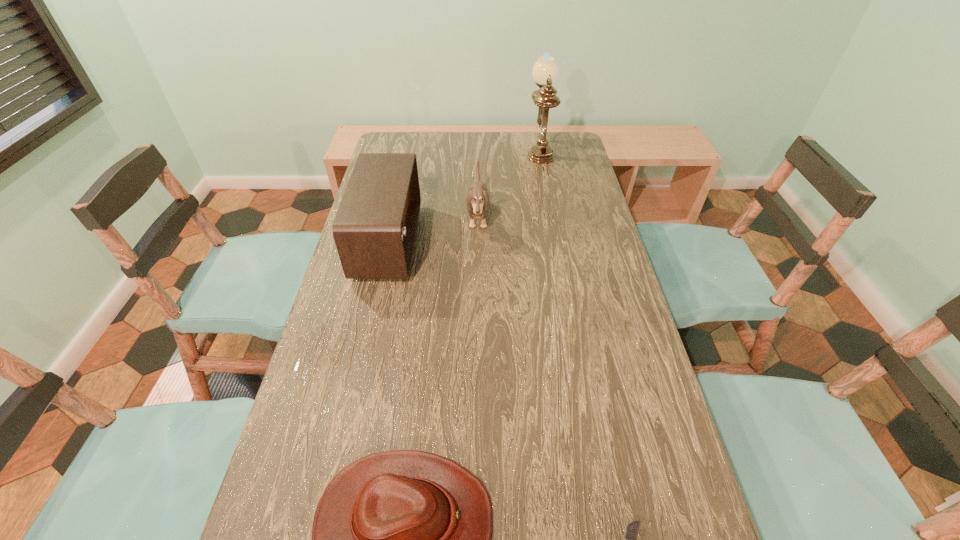
The image size is (960, 540). In order to click on oil lamp in this screenshot , I will do `click(545, 70)`.

Where is `the farthest object`? the farthest object is located at coordinates (545, 70).

The height and width of the screenshot is (540, 960). I want to click on radio receiver, so click(x=374, y=230).

Image resolution: width=960 pixels, height=540 pixels. In order to click on the third tallest object in this screenshot , I will do `click(478, 208)`.

The width and height of the screenshot is (960, 540). In order to click on free spot located on the left of the oil lamp in this screenshot , I will do `click(501, 149)`.

This screenshot has height=540, width=960. What are the coordinates of `blank space located on the front-facing side of the radio receiver` in the screenshot? It's located at (435, 242).

At what (x,y) coordinates should I click in order to perform the action: click on free space located 0.080m at the face of the third shortest object. Please return your answer as a coordinate pair (x, y). Image resolution: width=960 pixels, height=540 pixels. Looking at the image, I should click on (513, 217).

At what (x,y) coordinates should I click in order to perform the action: click on object that is at the far edge. Please return your answer as a coordinate pair (x, y). This screenshot has width=960, height=540. Looking at the image, I should click on (545, 70).

I want to click on object at the left edge, so click(x=374, y=230).

This screenshot has height=540, width=960. I want to click on object located in the right edge section of the desktop, so click(x=545, y=70).